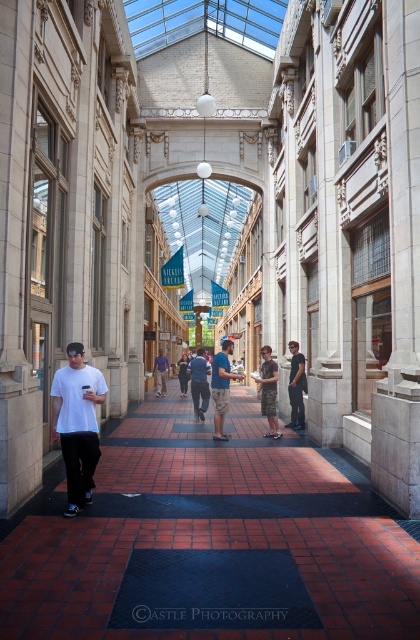
You are standing in the historic Nickel Arcade and notice two people wearing camouflage shorts at center and dark gray jeans at center. Which one is located to the left when facing the direction of the people?

The camouflage shorts at center is positioned on the left side of dark gray jeans at center, so the camouflage shorts at center is located to the left when facing the direction of the people.